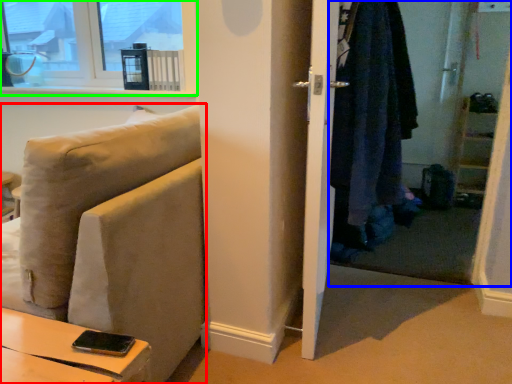
Question: Considering the real-world distances, which object is farthest from studio couch (highlighted by a red box)? closet (highlighted by a blue box) or window (highlighted by a green box)?

Choices:
 (A) closet
 (B) window

Answer: (B)